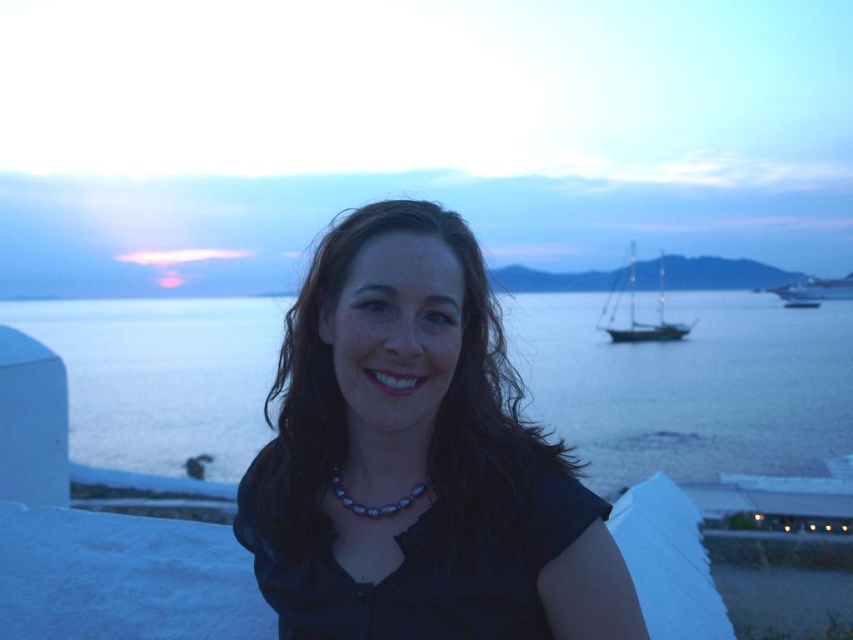
Between sailboat at right and pearl-like beads necklace at center, which one appears on the right side from the viewer's perspective?

sailboat at right

Can you confirm if sailboat at right is positioned below pearl-like beads necklace at center?

No, sailboat at right is not below pearl-like beads necklace at center.

Identify the location of sailboat at right. This screenshot has height=640, width=853. (635, 308).

Which is behind, point (659, 308) or point (819, 291)?

Positioned behind is point (819, 291).

Looking at this image, which of these two, sailboat at right or shiny silver sailboat at right, stands taller?

sailboat at right is taller.

The image size is (853, 640). In order to click on sailboat at right in this screenshot , I will do (635, 308).

Is point (489, 362) behind point (785, 365)?

No, (489, 362) is in front of (785, 365).

Who is taller, matte black shirt at center or blue water at center?

Standing taller between the two is blue water at center.

Is point (450, 253) positioned behind point (804, 324)?

That is False.

Find the location of a particular element. The image size is (853, 640). matte black shirt at center is located at coordinates (418, 460).